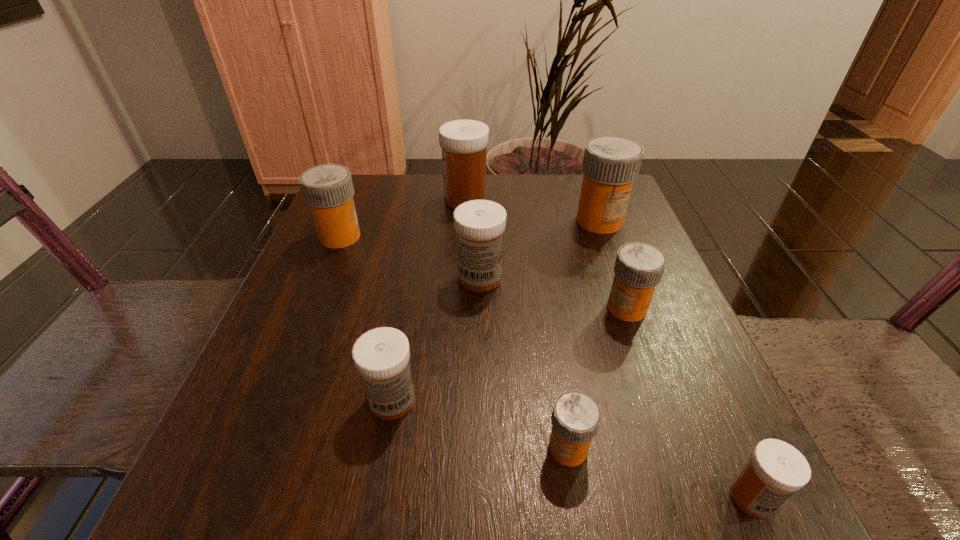
Identify the location of free point located 0.320m on the label side of the seventh farthest object. The height and width of the screenshot is (540, 960). (313, 448).

Find the location of a particular element. This screenshot has height=540, width=960. vacant area situated 0.060m on the label side of the seventh farthest object is located at coordinates (503, 448).

What are the coordinates of `vacant space positioned 0.080m on the label side of the seventh farthest object` in the screenshot? It's located at (489, 448).

Locate an element on the screen. The image size is (960, 540). blank area located on the left of the nearest white medicine is located at coordinates (491, 497).

Image resolution: width=960 pixels, height=540 pixels. In order to click on object present at the left edge in this screenshot , I will do `click(328, 189)`.

Locate an element on the screen. The width and height of the screenshot is (960, 540). object at the far left corner is located at coordinates (328, 189).

At what (x,y) coordinates should I click in order to perform the action: click on object at the far right corner. Please return your answer as a coordinate pair (x, y). Looking at the image, I should click on (610, 165).

Locate an element on the screen. This screenshot has height=540, width=960. object present at the near right corner is located at coordinates (775, 470).

The image size is (960, 540). Find the location of `blank space at the far edge`. blank space at the far edge is located at coordinates pyautogui.click(x=543, y=225).

At what (x,y) coordinates should I click in order to perform the action: click on free space at the near edge of the desktop. Please return your answer as a coordinate pair (x, y). The height and width of the screenshot is (540, 960). Looking at the image, I should click on coord(619,463).